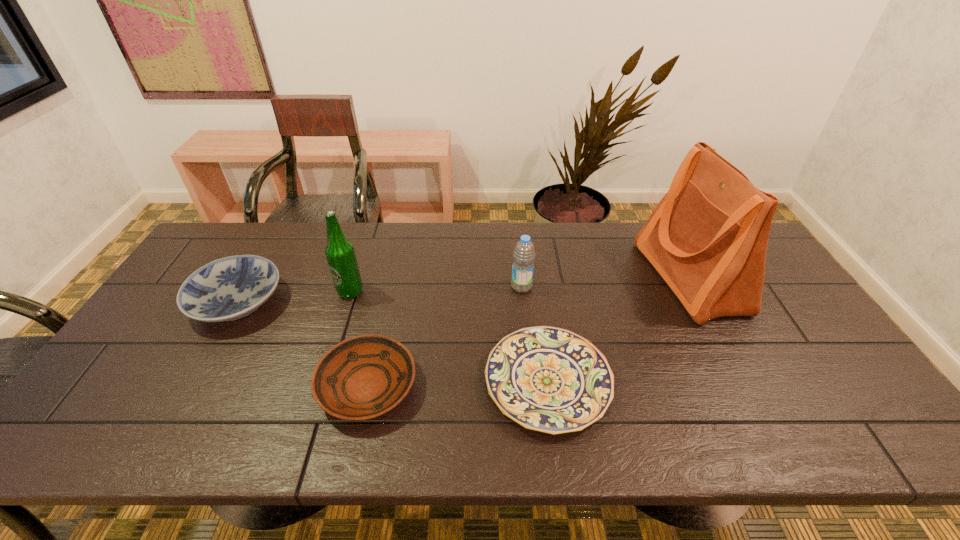
I want to click on free space at the far edge, so click(426, 249).

What are the coordinates of `vacant area at the near edge` in the screenshot? It's located at (678, 424).

The image size is (960, 540). I want to click on vacant area at the left edge of the desktop, so click(x=133, y=400).

You are a GUI agent. You are given a task and a screenshot of the screen. Output one action in this format:
    pyautogui.click(x=<x>, y=<y>)
    Task: Click on the free space at the right edge of the desktop
    The image size is (960, 540).
    Given the screenshot: What is the action you would take?
    pyautogui.click(x=785, y=327)

This screenshot has width=960, height=540. What are the coordinates of `vacant space at the near left corner of the desktop` in the screenshot? It's located at (84, 434).

Image resolution: width=960 pixels, height=540 pixels. In order to click on free spot between the shortest object and the shopping bag in this screenshot , I will do `click(618, 329)`.

Identify the location of empty location between the water bottle and the fifth shortest object. This screenshot has width=960, height=540. (436, 289).

The width and height of the screenshot is (960, 540). Find the location of `free spot between the shortest plate and the fifth tallest object`. free spot between the shortest plate and the fifth tallest object is located at coordinates (458, 384).

Identify the location of vacant space that's between the shortest object and the rightmost object. The image size is (960, 540). (618, 329).

Image resolution: width=960 pixels, height=540 pixels. What are the coordinates of `empty location between the tallest plate and the second tallest object` in the screenshot? It's located at (294, 296).